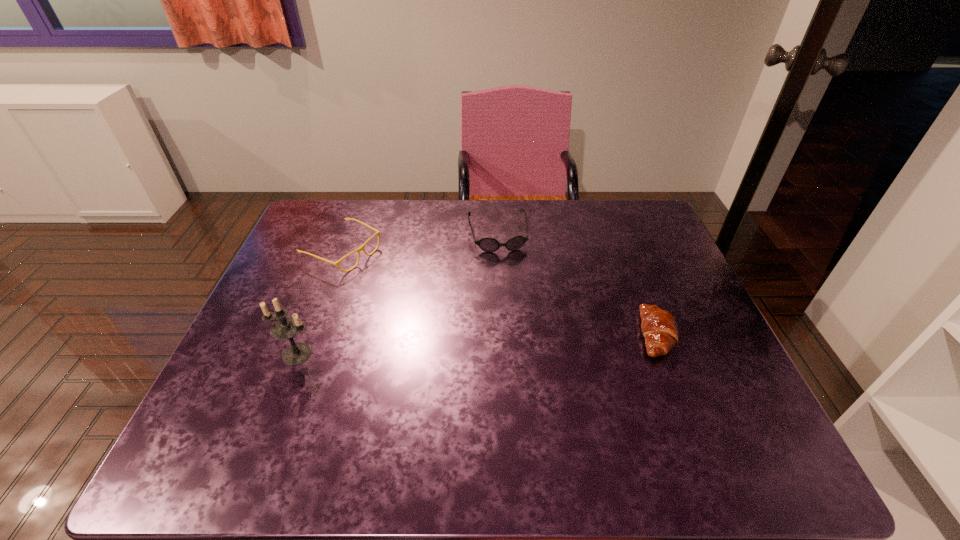
Locate an element on the screen. This screenshot has height=540, width=960. vacant space at the left edge of the desktop is located at coordinates (330, 289).

What are the coordinates of `free region at the right edge of the desktop` in the screenshot? It's located at (701, 342).

Identify the location of free space at the far left corner of the desktop. This screenshot has height=540, width=960. (338, 223).

In the image, there is a desktop. Where is `free region at the far right corner`? free region at the far right corner is located at coordinates (623, 215).

I want to click on free point between the tallest object and the spectacles, so click(320, 302).

Where is `vacant space that is in between the sunglasses and the crescent roll`? vacant space that is in between the sunglasses and the crescent roll is located at coordinates (576, 285).

What are the coordinates of `empty location between the candle holder and the crescent roll` in the screenshot? It's located at (476, 344).

I want to click on vacant space that's between the spectacles and the crescent roll, so point(499,293).

Find the location of a particular element. vacant area that lies between the crescent roll and the sunglasses is located at coordinates (576, 285).

Locate an element on the screen. free point between the crescent roll and the tallest object is located at coordinates (476, 344).